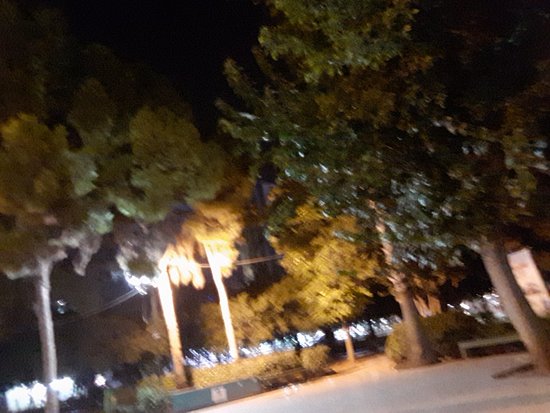
This screenshot has width=550, height=413. In order to click on bench in this screenshot , I will do `click(485, 338)`.